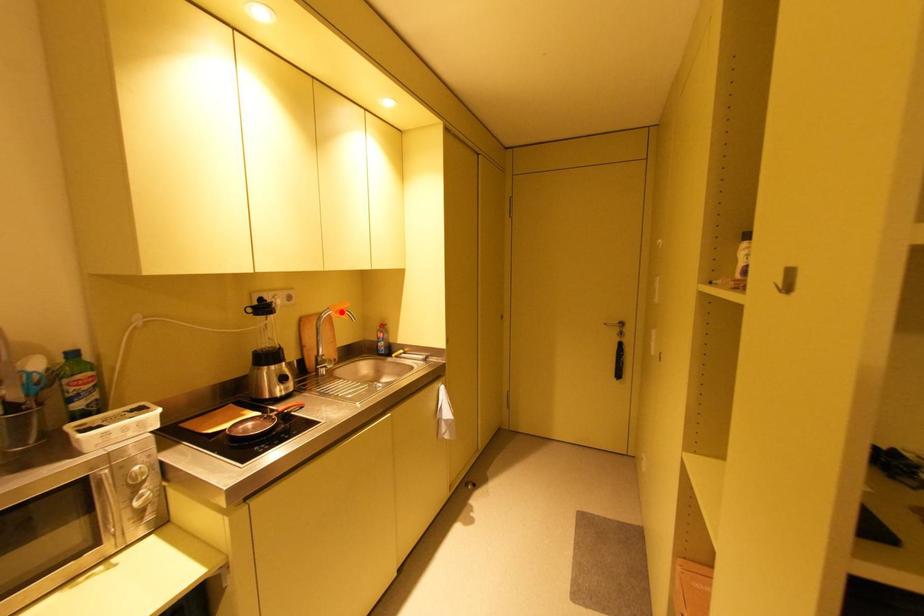
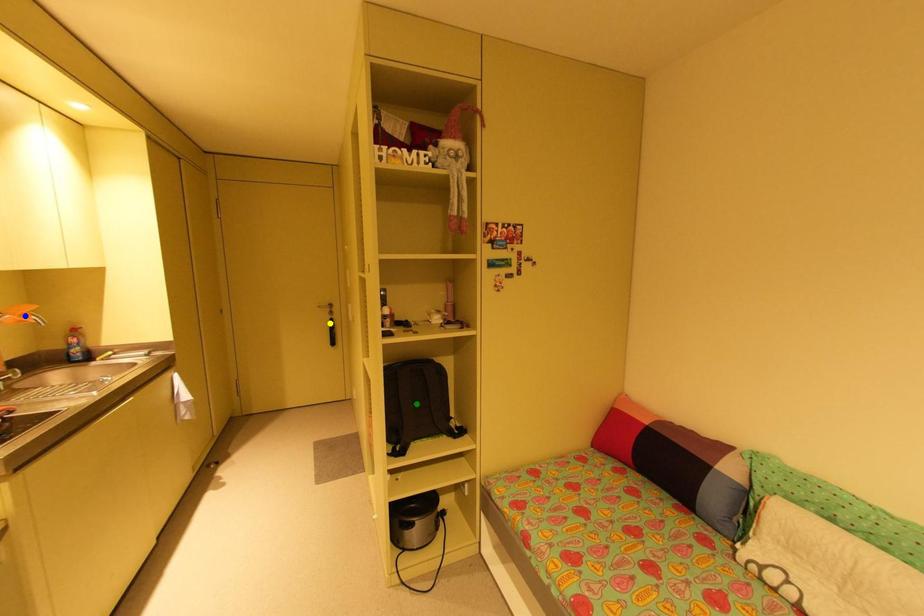
Question: I am providing you with two images of the same scene from different viewpoints. A red point is marked on the first image. You are given multiple points on the second image. Which point in image 2 is actually the same real-world point as the red point in image 1?

Choices:
 (A) blue point
 (B) green point
 (C) yellow point

Answer: (A)